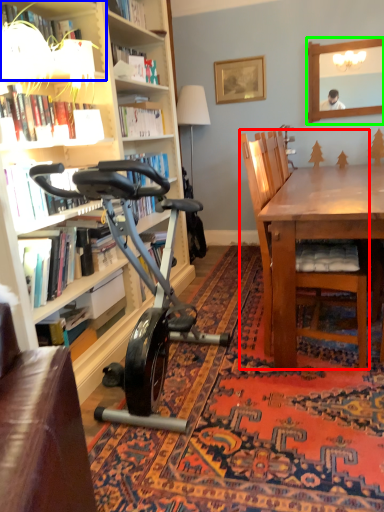
Question: Considering the real-world distances, which object is closest to chair (highlighted by a red box)? shelf (highlighted by a blue box) or mirror (highlighted by a green box).

Choices:
 (A) shelf
 (B) mirror

Answer: (A)